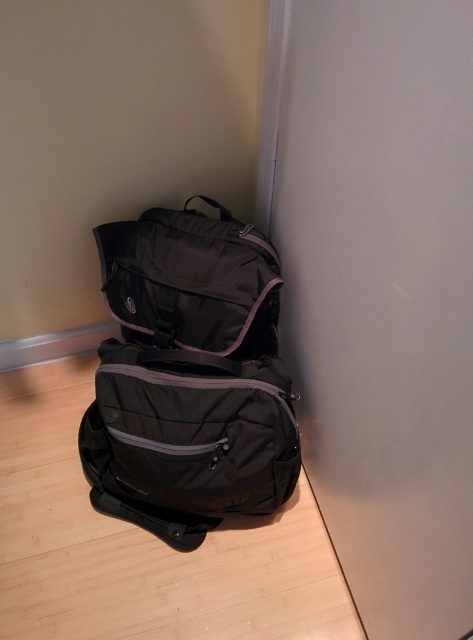
Question: Is matte black backpack at lower left positioned before matte black bag at upper left?

Choices:
 (A) yes
 (B) no

Answer: (A)

Question: Which of the following is the closest to the observer?

Choices:
 (A) coord(134,417)
 (B) coord(231,268)

Answer: (A)

Question: Which point is farther from the camera taking this photo?

Choices:
 (A) (271, 451)
 (B) (230, 260)

Answer: (B)

Question: Can you confirm if matte black backpack at lower left is positioned above matte black bag at upper left?

Choices:
 (A) yes
 (B) no

Answer: (B)

Question: Does matte black backpack at lower left come behind matte black bag at upper left?

Choices:
 (A) no
 (B) yes

Answer: (A)

Question: Which point is closer to the camera taking this photo?

Choices:
 (A) (86, 440)
 (B) (173, 289)

Answer: (B)